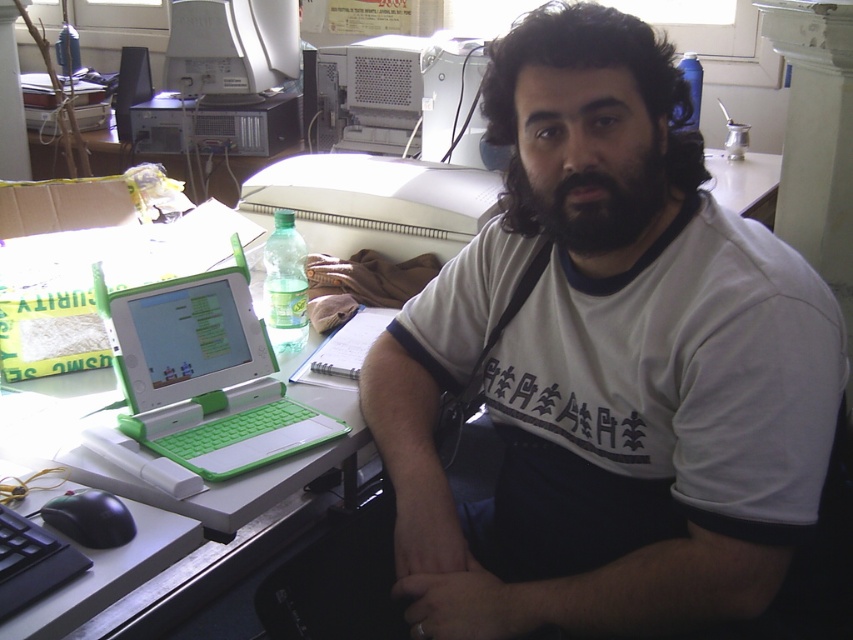
Can you confirm if white cotton t-shirt at center is positioned to the right of dark blue fabric at lower center?

No, white cotton t-shirt at center is not to the right of dark blue fabric at lower center.

Does white cotton t-shirt at center appear under dark blue fabric at lower center?

No.

At what (x,y) coordinates should I click in order to perform the action: click on white cotton t-shirt at center. Please return your answer as a coordinate pair (x, y). This screenshot has width=853, height=640. Looking at the image, I should click on [610, 364].

Can you confirm if white cotton t-shirt at center is wider than white plastic monitor at upper center?

Correct, the width of white cotton t-shirt at center exceeds that of white plastic monitor at upper center.

Which is behind, point (546, 621) or point (279, 10)?

Positioned behind is point (279, 10).

Locate an element on the screen. Image resolution: width=853 pixels, height=640 pixels. white cotton t-shirt at center is located at coordinates (610, 364).

Based on the photo, is dark brown fuzzy beard at center to the right of white plastic monitor at upper center from the viewer's perspective?

Indeed, dark brown fuzzy beard at center is positioned on the right side of white plastic monitor at upper center.

Is dark brown fuzzy beard at center to the left of white plastic monitor at upper center from the viewer's perspective?

Incorrect, dark brown fuzzy beard at center is not on the left side of white plastic monitor at upper center.

Is point (602, 252) positioned behind point (195, 58)?

No, (602, 252) is closer to viewer.

Locate an element on the screen. dark brown fuzzy beard at center is located at coordinates (590, 200).